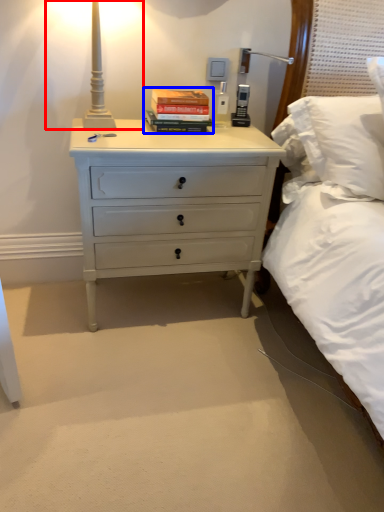
Question: Which object appears farthest to the camera in this image, bedside lamp (highlighted by a red box) or paperback book (highlighted by a blue box)?

Choices:
 (A) bedside lamp
 (B) paperback book

Answer: (B)